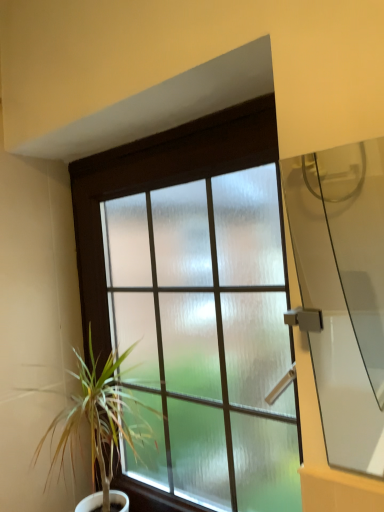
Question: From the image's perspective, is green leafy plant at left above or below transparent glass door at right?

Choices:
 (A) above
 (B) below

Answer: (B)

Question: From their relative heights in the image, would you say green leafy plant at left is taller or shorter than transparent glass door at right?

Choices:
 (A) short
 (B) tall

Answer: (B)

Question: Which object is positioned closest to the transparent glass door at right?

Choices:
 (A) green leafy plant at left
 (B) frosted glass window at center

Answer: (B)

Question: Estimate the real-world distances between objects in this image. Which object is closer to the frosted glass window at center?

Choices:
 (A) green leafy plant at left
 (B) transparent glass door at right

Answer: (A)